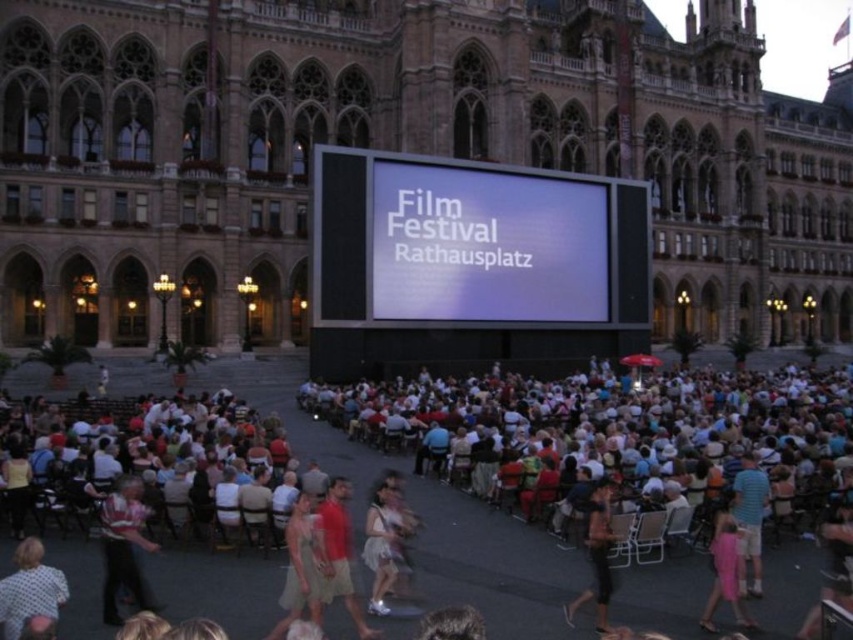
This screenshot has height=640, width=853. What are the coordinates of `white cotton dress at center` in the screenshot? It's located at (381, 545).

Who is more distant from viewer, (379, 529) or (732, 572)?

The point (379, 529) is behind.

This screenshot has height=640, width=853. I want to click on white cotton dress at center, so click(381, 545).

Which is above, white glossy screen at center or pink fabric dress at lower right?

white glossy screen at center

Does white glossy screen at center have a greater width compared to pink fabric dress at lower right?

Correct, the width of white glossy screen at center exceeds that of pink fabric dress at lower right.

Find the location of a particular element. The width and height of the screenshot is (853, 640). white glossy screen at center is located at coordinates (486, 244).

Does point (149, 602) come closer to viewer compared to point (717, 604)?

Yes, it is in front of point (717, 604).

Between point (129, 541) and point (732, 557), which one is positioned in front?

Point (129, 541) is in front.

The width and height of the screenshot is (853, 640). Find the location of `striped cotton shirt at lower left`. striped cotton shirt at lower left is located at coordinates tap(123, 550).